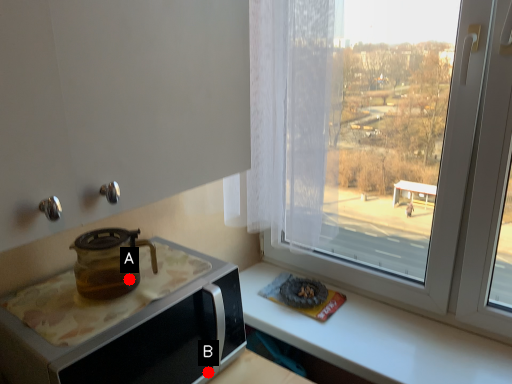
Question: Two points are circled on the image, labeled by A and B beside each circle. Which point is further to the camera?

Choices:
 (A) A is further
 (B) B is further

Answer: (B)